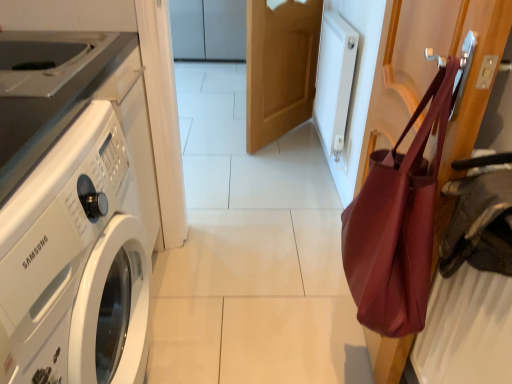
Question: From a real-world perspective, is white glossy washing machine at left under matte burgundy tote bag at right?

Choices:
 (A) yes
 (B) no

Answer: (A)

Question: Is white glossy washing machine at left at the left side of matte burgundy tote bag at right?

Choices:
 (A) yes
 (B) no

Answer: (A)

Question: From a real-world perspective, is white glossy washing machine at left on matte burgundy tote bag at right?

Choices:
 (A) yes
 (B) no

Answer: (B)

Question: Can you confirm if white glossy washing machine at left is bigger than matte burgundy tote bag at right?

Choices:
 (A) no
 (B) yes

Answer: (B)

Question: Is white glossy washing machine at left looking in the opposite direction of matte burgundy tote bag at right?

Choices:
 (A) no
 (B) yes

Answer: (A)

Question: Is white glossy washing machine at left completely or partially outside of matte burgundy tote bag at right?

Choices:
 (A) yes
 (B) no

Answer: (A)

Question: From a real-world perspective, is matte burgundy tote bag at right positioned over light brown wood door at center based on gravity?

Choices:
 (A) yes
 (B) no

Answer: (A)

Question: Is the position of matte burgundy tote bag at right more distant than that of light brown wood door at center?

Choices:
 (A) no
 (B) yes

Answer: (A)

Question: Can you confirm if matte burgundy tote bag at right is bigger than light brown wood door at center?

Choices:
 (A) no
 (B) yes

Answer: (A)

Question: Is matte burgundy tote bag at right wider than light brown wood door at center?

Choices:
 (A) yes
 (B) no

Answer: (A)

Question: Is matte burgundy tote bag at right smaller than light brown wood door at center?

Choices:
 (A) no
 (B) yes

Answer: (B)

Question: Is matte burgundy tote bag at right oriented away from light brown wood door at center?

Choices:
 (A) yes
 (B) no

Answer: (B)

Question: From a real-world perspective, is matte burgundy tote bag at right on top of white glossy washing machine at left?

Choices:
 (A) no
 (B) yes

Answer: (B)